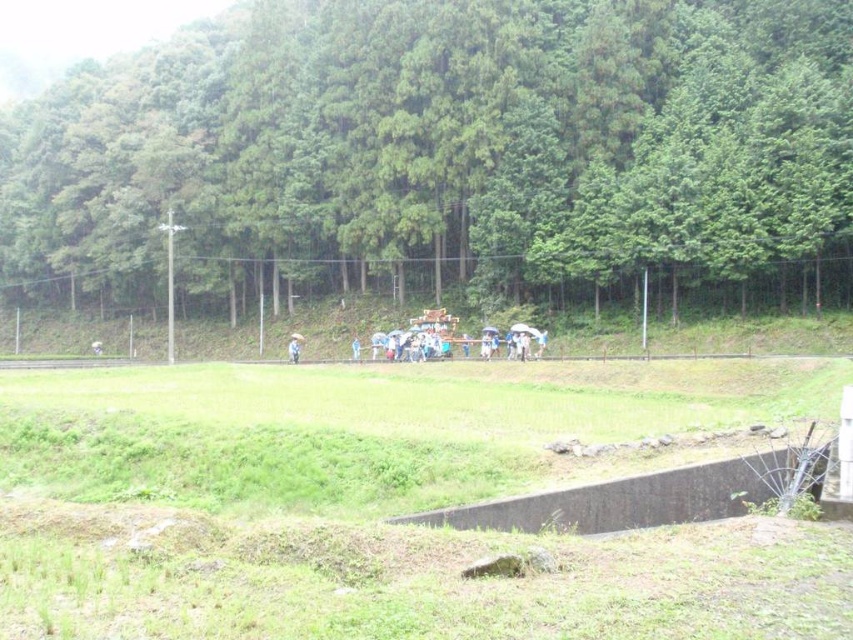
Does green leafy trees at upper center have a lesser width compared to blue fabric umbrella at center?

In fact, green leafy trees at upper center might be wider than blue fabric umbrella at center.

Can you confirm if green leafy trees at upper center is positioned to the right of blue fabric umbrella at center?

Incorrect, green leafy trees at upper center is not on the right side of blue fabric umbrella at center.

At what (x,y) coordinates should I click in order to perform the action: click on green leafy trees at upper center. Please return your answer as a coordinate pair (x, y). Looking at the image, I should click on (445, 156).

In order to click on green leafy trees at upper center in this screenshot , I will do `click(445, 156)`.

Does green leafy trees at upper center have a larger size compared to white fabric umbrella at center?

Yes, green leafy trees at upper center is bigger than white fabric umbrella at center.

Is point (289, 99) positioned in front of point (291, 349)?

No.

Is point (550, 188) farther from camera compared to point (300, 340)?

No, it is in front of (300, 340).

Find the location of a particular element. This screenshot has width=853, height=640. green leafy trees at upper center is located at coordinates coord(445,156).

Between white fabric umbrella at center and blue fabric umbrella at center, which one is positioned higher?

white fabric umbrella at center is higher up.

Who is taller, white fabric umbrella at center or blue fabric umbrella at center?

Standing taller between the two is white fabric umbrella at center.

The image size is (853, 640). What do you see at coordinates (294, 348) in the screenshot?
I see `white fabric umbrella at center` at bounding box center [294, 348].

The image size is (853, 640). What are the coordinates of `white fabric umbrella at center` in the screenshot? It's located at (294, 348).